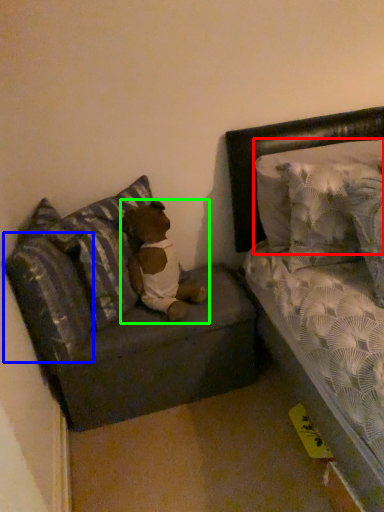
Question: Which object is positioned farthest from pillow (highlighted by a red box)? Select from pillow (highlighted by a blue box) and teddy (highlighted by a green box).

Choices:
 (A) pillow
 (B) teddy

Answer: (A)